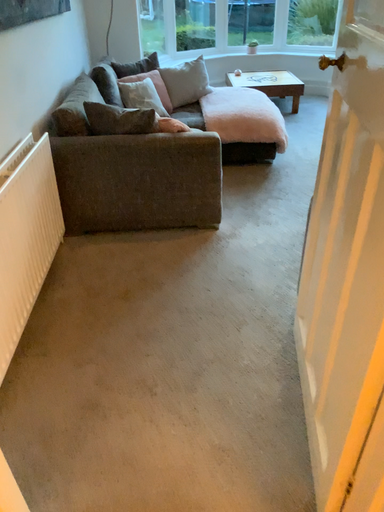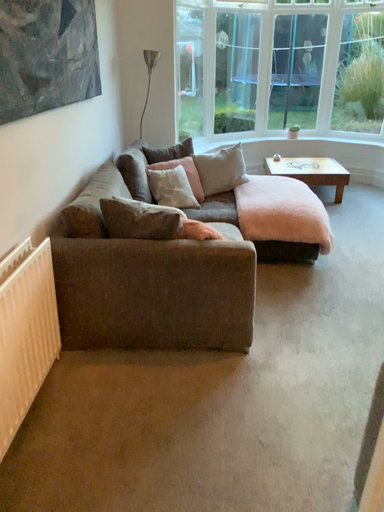
Question: How did the camera likely rotate when shooting the video?

Choices:
 (A) rotated downward
 (B) rotated upward

Answer: (B)